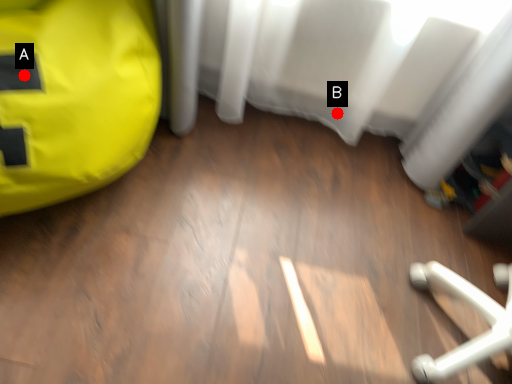
Question: Two points are circled on the image, labeled by A and B beside each circle. Which point is farther to the camera?

Choices:
 (A) A is further
 (B) B is further

Answer: (B)